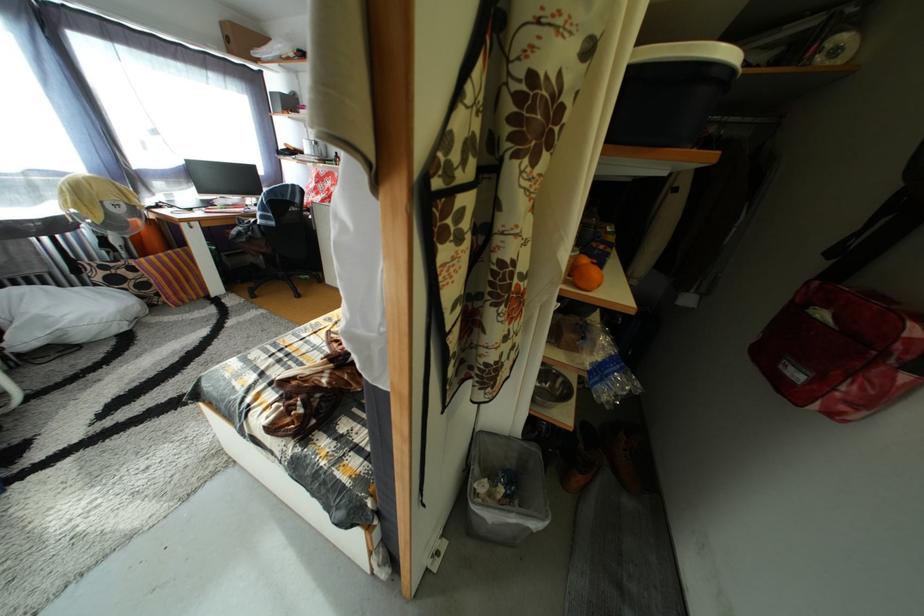
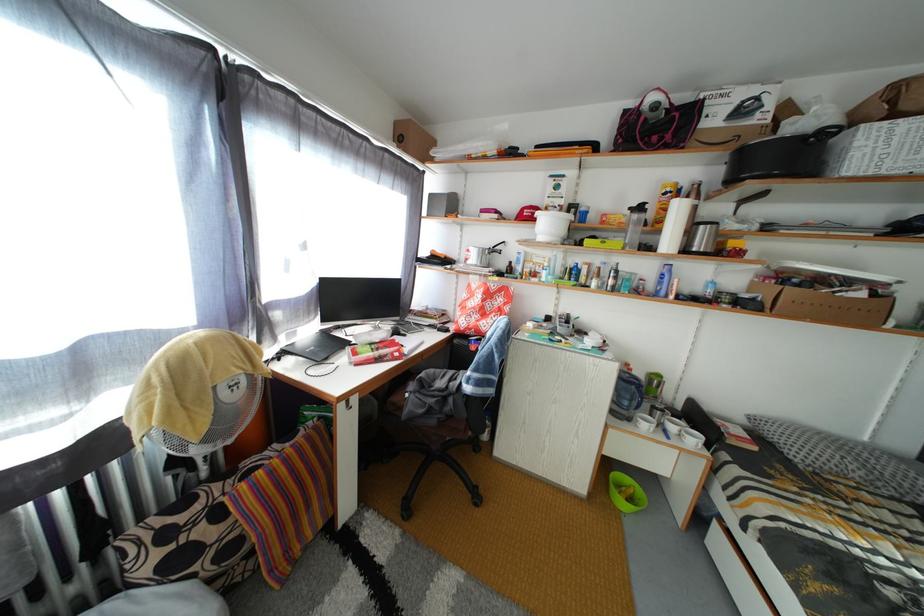
The images are taken continuously from a first-person perspective. In which direction are you moving?

The cameraman walked toward left, forward.